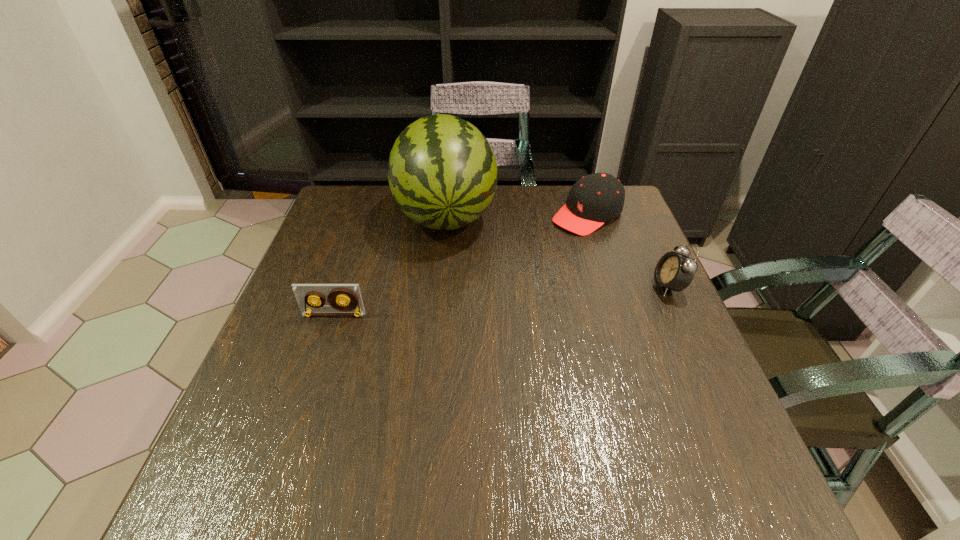
This screenshot has height=540, width=960. Find the location of `vacant space on the desktop that is between the nearest object and the second nearest object and is positioned on the front-facing side of the cap`. vacant space on the desktop that is between the nearest object and the second nearest object and is positioned on the front-facing side of the cap is located at coordinates (457, 305).

Find the location of a particular element. free space on the desktop that is between the videotape and the alarm clock and is positioned at the stem end of the tallest object is located at coordinates (458, 304).